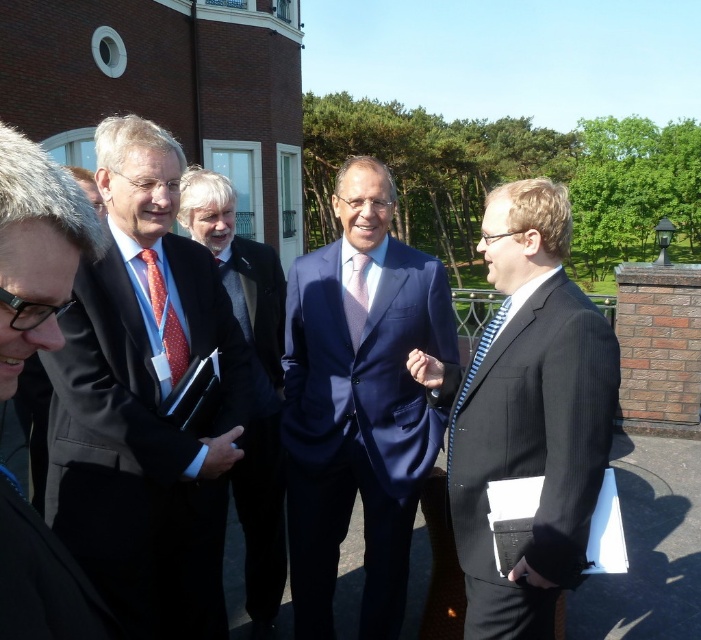
Question: Is blue striped tie at right smaller than matte red tie at center?

Choices:
 (A) no
 (B) yes

Answer: (A)

Question: Is polished dark suit at center positioned in front of matte red tie at center?

Choices:
 (A) yes
 (B) no

Answer: (A)

Question: Which point is farther to the camera?

Choices:
 (A) black pinstripe suit at center
 (B) navy blue suit at center

Answer: (B)

Question: Considering the relative positions of black pinstripe suit at center and polished dark suit at center in the image provided, where is black pinstripe suit at center located with respect to polished dark suit at center?

Choices:
 (A) above
 (B) below

Answer: (B)

Question: Which is farther from the purple satin tie at center?

Choices:
 (A) matte black suit at left
 (B) red dotted tie at center

Answer: (A)

Question: Which point appears farthest from the camera in this image?

Choices:
 (A) (156, 326)
 (B) (265, 436)
 (C) (515, 301)
 (D) (233, 275)

Answer: (D)